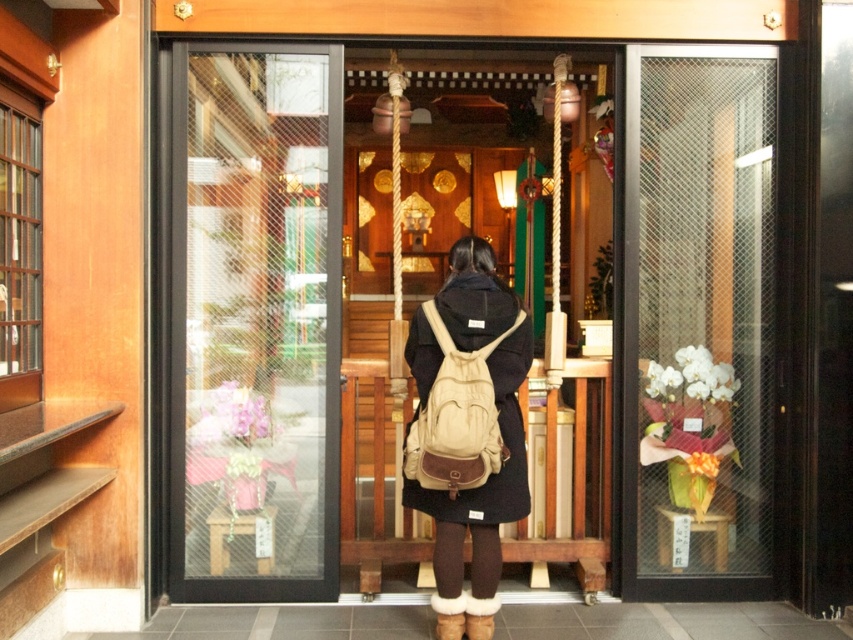
Question: Does transparent glass door at center come behind clear glass door at right?

Choices:
 (A) no
 (B) yes

Answer: (A)

Question: Which of these objects is positioned farthest from the canvas backpack at center?

Choices:
 (A) clear glass door at right
 (B) transparent glass door at center
 (C) matte black elevator at center
 (D) beige canvas backpack at center

Answer: (A)

Question: Estimate the real-world distances between objects in this image. Which object is farther from the transparent glass door at center?

Choices:
 (A) clear glass door at right
 (B) canvas backpack at center
 (C) matte black elevator at center
 (D) beige canvas backpack at center

Answer: (A)

Question: Does matte black elevator at center appear on the right side of beige canvas backpack at center?

Choices:
 (A) no
 (B) yes

Answer: (B)

Question: Which point is farther from the camera taking this photo?

Choices:
 (A) (608, 413)
 (B) (711, 96)
 (C) (463, 388)

Answer: (A)

Question: Observing the image, what is the correct spatial positioning of clear glass door at right in reference to beige canvas backpack at center?

Choices:
 (A) left
 (B) right

Answer: (B)